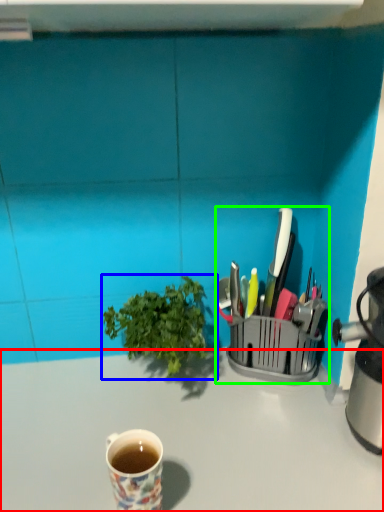
Question: Estimate the real-world distances between objects in this image. Which object is farther from desk (highlighted by a red box), houseplant (highlighted by a blue box) or appliance (highlighted by a green box)?

Choices:
 (A) houseplant
 (B) appliance

Answer: (B)